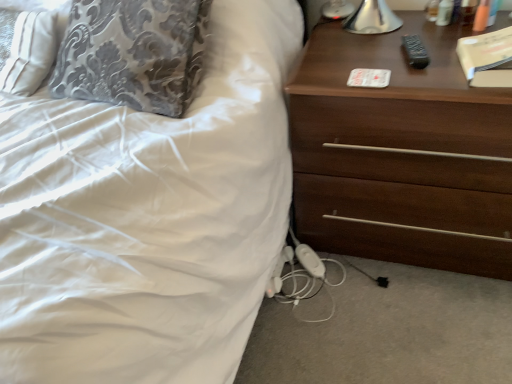
Question: Can you confirm if dark brown wood chest of drawers at right is thinner than beige matte book at upper right?

Choices:
 (A) yes
 (B) no

Answer: (B)

Question: From a real-world perspective, is dark brown wood chest of drawers at right over beige matte book at upper right?

Choices:
 (A) yes
 (B) no

Answer: (B)

Question: Is there a large distance between dark brown wood chest of drawers at right and beige matte book at upper right?

Choices:
 (A) yes
 (B) no

Answer: (B)

Question: Is dark brown wood chest of drawers at right to the right of beige matte book at upper right from the viewer's perspective?

Choices:
 (A) no
 (B) yes

Answer: (A)

Question: Considering the relative sizes of dark brown wood chest of drawers at right and beige matte book at upper right in the image provided, is dark brown wood chest of drawers at right smaller than beige matte book at upper right?

Choices:
 (A) no
 (B) yes

Answer: (A)

Question: Is dark brown wood chest of drawers at right oriented towards beige matte book at upper right?

Choices:
 (A) yes
 (B) no

Answer: (B)

Question: From a real-world perspective, is beige matte book at upper right located beneath dark brown wood chest of drawers at right?

Choices:
 (A) no
 (B) yes

Answer: (A)

Question: Can you confirm if beige matte book at upper right is thinner than dark brown wood chest of drawers at right?

Choices:
 (A) no
 (B) yes

Answer: (B)

Question: From a real-world perspective, is beige matte book at upper right physically above dark brown wood chest of drawers at right?

Choices:
 (A) no
 (B) yes

Answer: (B)

Question: Does beige matte book at upper right have a smaller size compared to dark brown wood chest of drawers at right?

Choices:
 (A) no
 (B) yes

Answer: (B)

Question: Is beige matte book at upper right closer to camera compared to dark brown wood chest of drawers at right?

Choices:
 (A) yes
 (B) no

Answer: (B)

Question: Can you confirm if beige matte book at upper right is positioned to the left of dark brown wood chest of drawers at right?

Choices:
 (A) yes
 (B) no

Answer: (B)

Question: Based on their sizes in the image, would you say beige matte book at upper right is bigger or smaller than dark brown wood chest of drawers at right?

Choices:
 (A) big
 (B) small

Answer: (B)